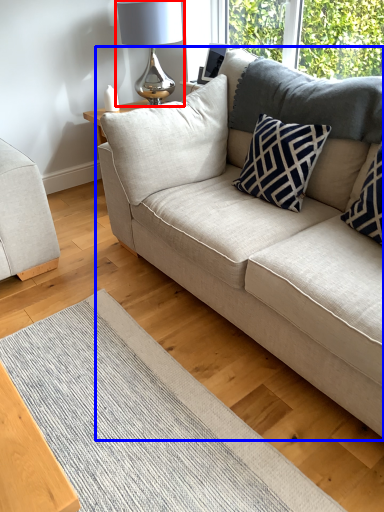
Question: Which point is further to the camera, table lamp (highlighted by a red box) or studio couch (highlighted by a blue box)?

Choices:
 (A) table lamp
 (B) studio couch

Answer: (A)